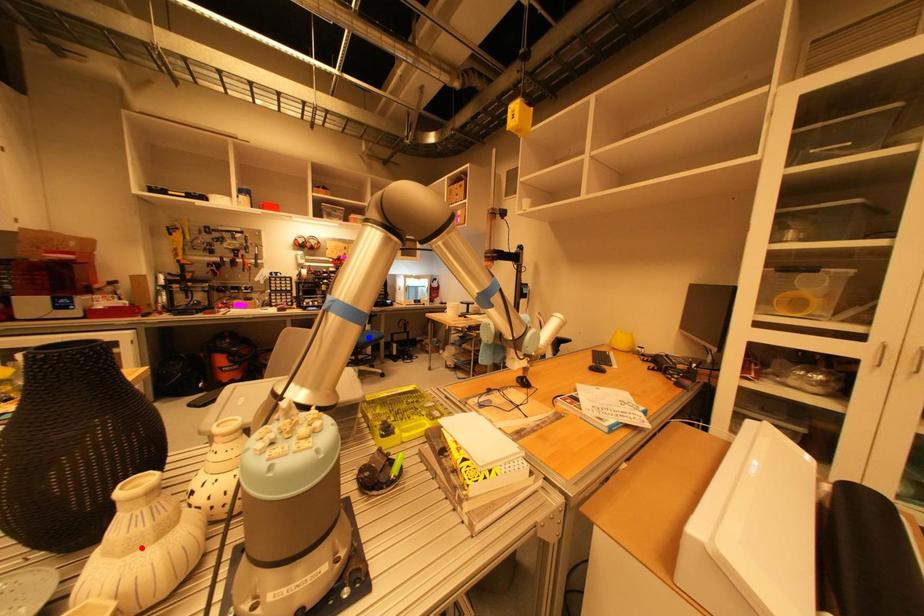
Question: In the image, two points are highlighted. Which point is nearer to the camera? Reply with the corresponding letter.

Choices:
 (A) blue point
 (B) red point

Answer: (B)